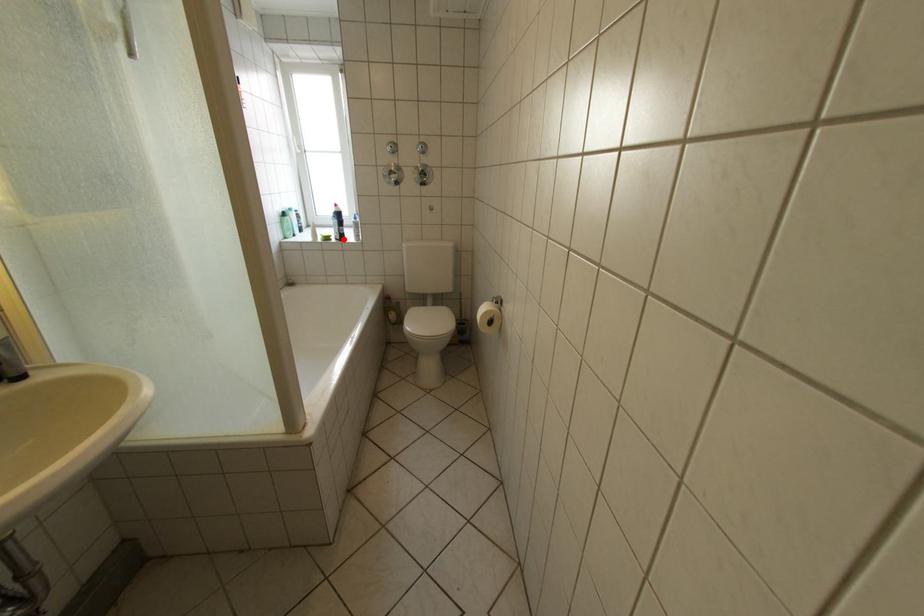
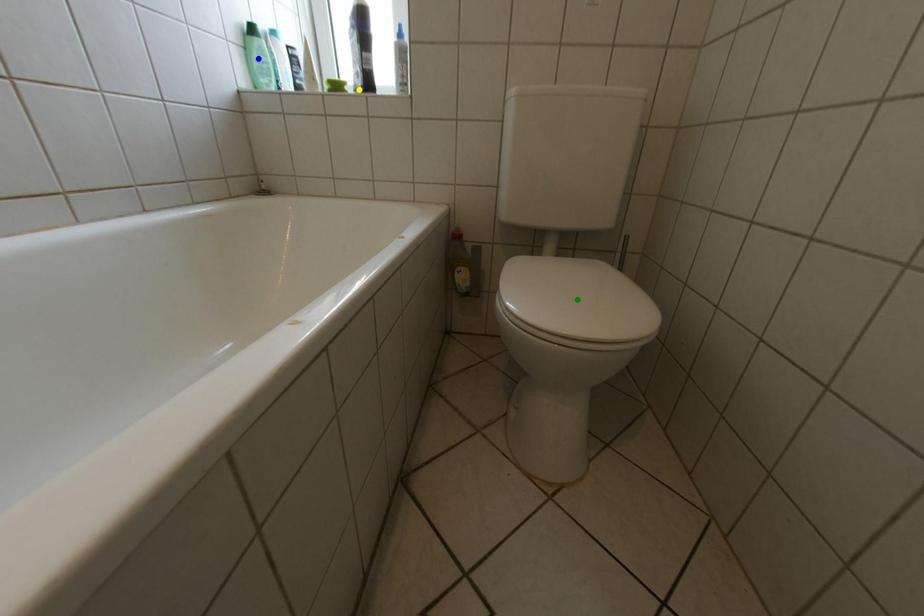
Question: I am providing you with two images of the same scene from different viewpoints. A red point is marked on the first image. You are given multiple points on the second image. Which spot in image 2 lines up with the point in image 1?

Choices:
 (A) yellow point
 (B) green point
 (C) blue point

Answer: (A)